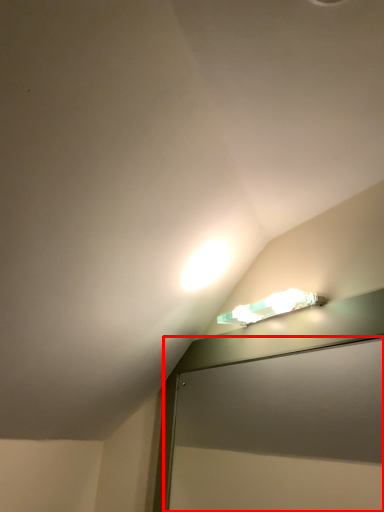
Question: From the image, what is the correct spatial relationship of screen door (annotated by the red box) in relation to lamp?

Choices:
 (A) left
 (B) right

Answer: (A)